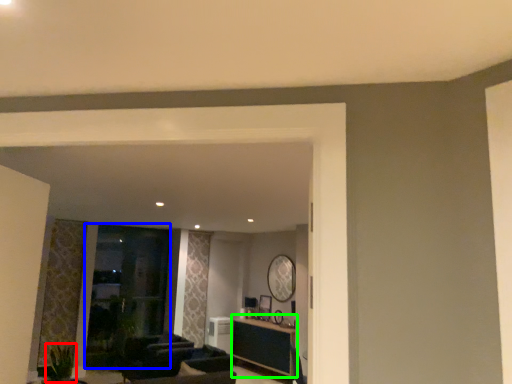
Question: Which object is the closest to the plant (highlighted by a red box)? Choose among these: glass door (highlighted by a blue box) or table (highlighted by a green box).

Choices:
 (A) glass door
 (B) table

Answer: (A)